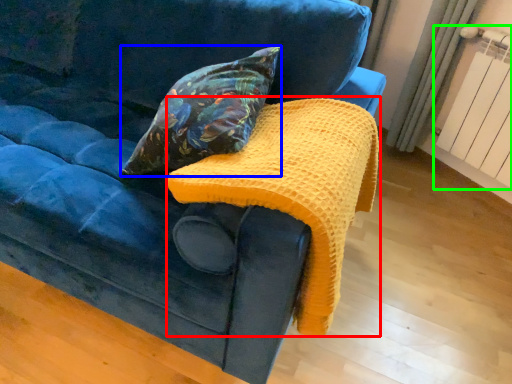
Question: Which is nearer to the blanket (highlighted by a red box)? pillow (highlighted by a blue box) or radiator (highlighted by a green box).

Choices:
 (A) pillow
 (B) radiator

Answer: (A)